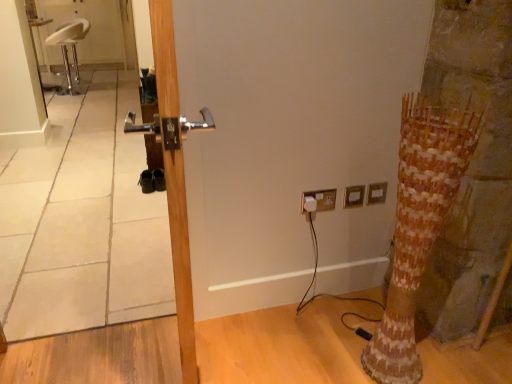
Question: From a real-world perspective, is metallic silver mirror at left physically located above or below white plastic electric outlet at upper right, which is the 1th electric outlet from right to left?

Choices:
 (A) below
 (B) above

Answer: (B)

Question: In terms of height, does metallic silver mirror at left look taller or shorter compared to white plastic electric outlet at upper right, which is the 1th electric outlet from right to left?

Choices:
 (A) short
 (B) tall

Answer: (B)

Question: Which object is positioned farthest from the white plastic socket at upper right, which is counted as the 1th electric outlet, starting from the left?

Choices:
 (A) metallic silver mirror at left
 (B) wooden textured tree trunk at right
 (C) white leather stool at upper left
 (D) white plastic electric outlet at upper right, which is the 1th electric outlet from right to left
 (E) gold metallic electric outlet at upper right, the 2th electric outlet in the left-to-right sequence

Answer: (C)

Question: Which object is the farthest from the white plastic socket at upper right, which is counted as the 1th electric outlet, starting from the left?

Choices:
 (A) wooden textured tree trunk at right
 (B) gold metallic electric outlet at upper right, which is the second electric outlet from right to left
 (C) white plastic electric outlet at upper right, positioned as the 3th electric outlet in left-to-right order
 (D) metallic silver mirror at left
 (E) wooden door at center

Answer: (D)